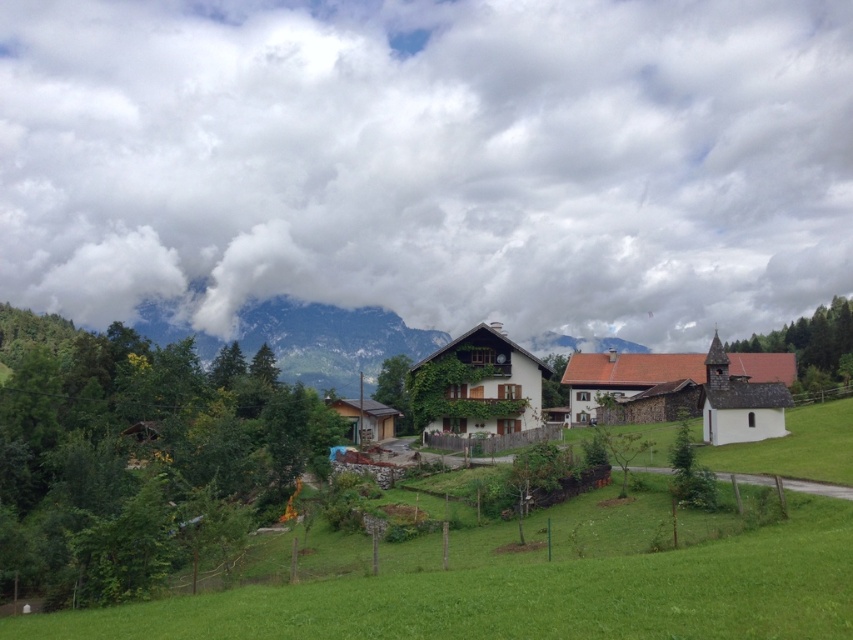
Question: Which point is closer to the camera taking this photo?

Choices:
 (A) (51, 620)
 (B) (651, 394)

Answer: (A)

Question: Among these points, which one is farthest from the camera?

Choices:
 (A) (279, 307)
 (B) (115, 214)
 (C) (503, 445)
 (D) (480, 536)

Answer: (B)

Question: Does green grassy field at center lie behind green textured mountain at upper center?

Choices:
 (A) no
 (B) yes

Answer: (A)

Question: Which is nearer to the green textured mountain at upper center?

Choices:
 (A) white wooden house at center
 (B) white fluffy cloud at upper center

Answer: (B)

Question: Is green grassy field at center in front of white wooden house at center?

Choices:
 (A) no
 (B) yes

Answer: (B)

Question: Can you confirm if green grassy field at center is thinner than green textured mountain at upper center?

Choices:
 (A) no
 (B) yes

Answer: (B)